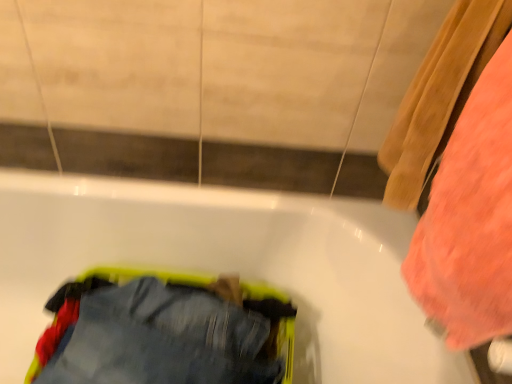
Question: Does white glossy bathtub at center lie behind denim pants at lower left?

Choices:
 (A) yes
 (B) no

Answer: (B)

Question: Can you confirm if white glossy bathtub at center is smaller than denim pants at lower left?

Choices:
 (A) yes
 (B) no

Answer: (B)

Question: Does white glossy bathtub at center appear on the right side of denim pants at lower left?

Choices:
 (A) no
 (B) yes

Answer: (A)

Question: From a real-world perspective, is white glossy bathtub at center beneath denim pants at lower left?

Choices:
 (A) yes
 (B) no

Answer: (A)

Question: Considering the relative sizes of white glossy bathtub at center and denim pants at lower left in the image provided, is white glossy bathtub at center bigger than denim pants at lower left?

Choices:
 (A) no
 (B) yes

Answer: (B)

Question: Is white glossy bathtub at center surrounding denim pants at lower left?

Choices:
 (A) no
 (B) yes

Answer: (B)

Question: Could you tell me if fluffy coral towel at right is turned towards white glossy bathtub at center?

Choices:
 (A) yes
 (B) no

Answer: (B)

Question: Is fluffy coral towel at right taller than white glossy bathtub at center?

Choices:
 (A) no
 (B) yes

Answer: (A)

Question: Considering the relative sizes of fluffy coral towel at right and white glossy bathtub at center in the image provided, is fluffy coral towel at right wider than white glossy bathtub at center?

Choices:
 (A) no
 (B) yes

Answer: (A)

Question: Does fluffy coral towel at right appear on the right side of white glossy bathtub at center?

Choices:
 (A) no
 (B) yes

Answer: (B)

Question: Is fluffy coral towel at right not inside white glossy bathtub at center?

Choices:
 (A) yes
 (B) no

Answer: (A)

Question: Does fluffy coral towel at right have a larger size compared to white glossy bathtub at center?

Choices:
 (A) no
 (B) yes

Answer: (A)

Question: Can you confirm if denim pants at lower left is thinner than white glossy bathtub at center?

Choices:
 (A) yes
 (B) no

Answer: (A)